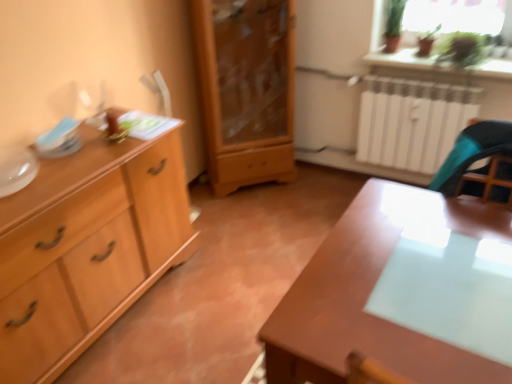
Where is `vacant space situated above light wood cabinet at left, the 1th chest of drawers positioned from the left (from a real-world perspective)`? vacant space situated above light wood cabinet at left, the 1th chest of drawers positioned from the left (from a real-world perspective) is located at coordinates (66, 160).